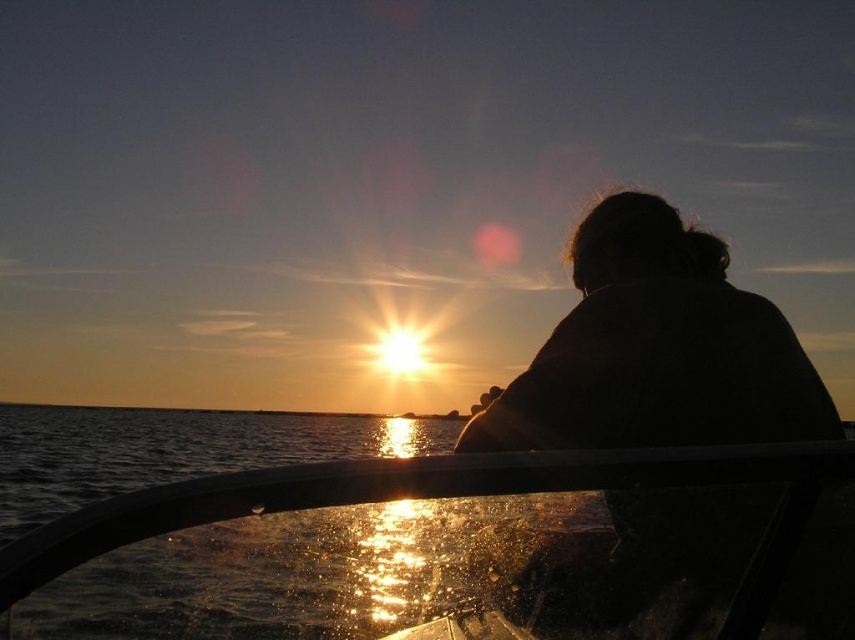
Question: Considering the relative positions of silhouette at center and transparent glass boat at center in the image provided, where is silhouette at center located with respect to transparent glass boat at center?

Choices:
 (A) left
 (B) right

Answer: (B)

Question: Which point is closer to the camera?

Choices:
 (A) silhouette at center
 (B) transparent glass boat at center

Answer: (A)

Question: In this image, where is silhouette at center located relative to transparent glass boat at center?

Choices:
 (A) left
 (B) right

Answer: (B)

Question: Can you confirm if silhouette at center is positioned above transparent glass boat at center?

Choices:
 (A) no
 (B) yes

Answer: (B)